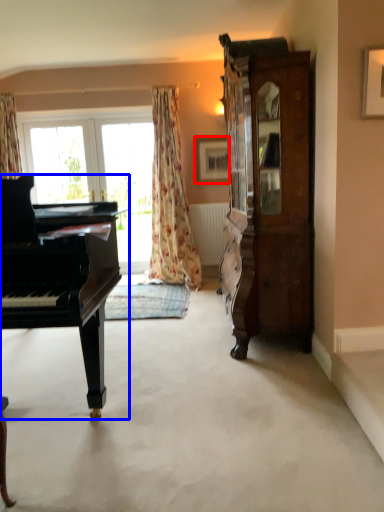
Question: Which object appears closest to the camera in this image, picture frame (highlighted by a red box) or piano (highlighted by a blue box)?

Choices:
 (A) picture frame
 (B) piano

Answer: (B)